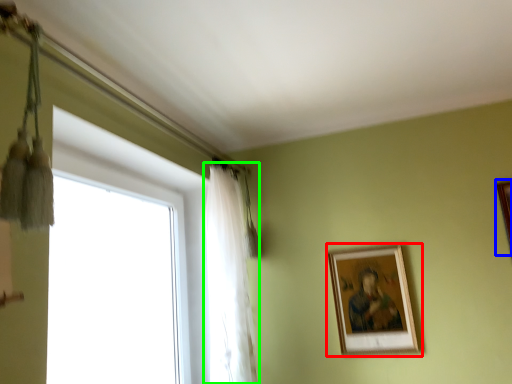
Question: Estimate the real-world distances between objects in this image. Which object is farther from picture frame (highlighted by a red box), picture frame (highlighted by a blue box) or curtain (highlighted by a green box)?

Choices:
 (A) picture frame
 (B) curtain

Answer: (A)